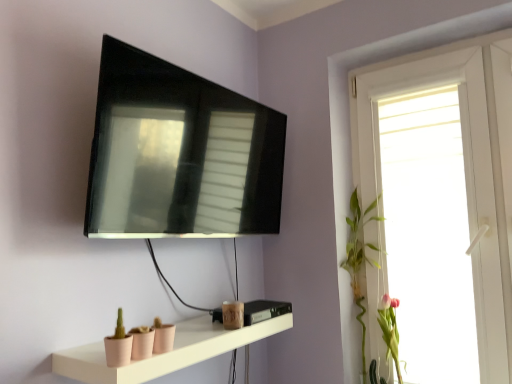
Question: From a real-world perspective, is matte pink shelf at lower center on top of white glossy window at upper right?

Choices:
 (A) no
 (B) yes

Answer: (A)

Question: From the image's perspective, is matte pink shelf at lower center beneath white glossy window at upper right?

Choices:
 (A) no
 (B) yes

Answer: (B)

Question: Is matte pink shelf at lower center to the right of white glossy window at upper right from the viewer's perspective?

Choices:
 (A) no
 (B) yes

Answer: (A)

Question: Does matte pink shelf at lower center turn towards white glossy window at upper right?

Choices:
 (A) yes
 (B) no

Answer: (B)

Question: Is matte pink shelf at lower center far away from white glossy window at upper right?

Choices:
 (A) no
 (B) yes

Answer: (A)

Question: Is matte pink shelf at lower center inside or outside of green leafy plant at right, the 1th plant viewed from the left?

Choices:
 (A) outside
 (B) inside

Answer: (A)

Question: From the image's perspective, is matte pink shelf at lower center located above or below green leafy plant at right, which is the second plant from right to left?

Choices:
 (A) above
 (B) below

Answer: (B)

Question: From their relative heights in the image, would you say matte pink shelf at lower center is taller or shorter than green leafy plant at right, which is the second plant from right to left?

Choices:
 (A) tall
 (B) short

Answer: (B)

Question: In terms of size, does matte pink shelf at lower center appear bigger or smaller than green leafy plant at right, which is the second plant from right to left?

Choices:
 (A) small
 (B) big

Answer: (A)

Question: From the image's perspective, is green leafy plant at right, which is the second plant from right to left, positioned above or below matte black tv at upper center?

Choices:
 (A) above
 (B) below

Answer: (B)

Question: In terms of width, does green leafy plant at right, the 1th plant viewed from the left, look wider or thinner when compared to matte black tv at upper center?

Choices:
 (A) wide
 (B) thin

Answer: (A)

Question: In the image, is green leafy plant at right, which is the second plant from right to left, positioned in front of or behind matte black tv at upper center?

Choices:
 (A) front
 (B) behind

Answer: (B)

Question: Would you say green leafy plant at right, which is the second plant from right to left, is to the left or to the right of matte black tv at upper center in the picture?

Choices:
 (A) right
 (B) left

Answer: (A)

Question: Is pink matte flower at right, positioned as the second plant in left-to-right order, spatially inside matte pink shelf at lower center, or outside of it?

Choices:
 (A) outside
 (B) inside

Answer: (A)

Question: Considering the positions of pink matte flower at right, positioned as the 1th plant in right-to-left order, and matte pink shelf at lower center in the image, is pink matte flower at right, positioned as the 1th plant in right-to-left order, wider or thinner than matte pink shelf at lower center?

Choices:
 (A) wide
 (B) thin

Answer: (B)